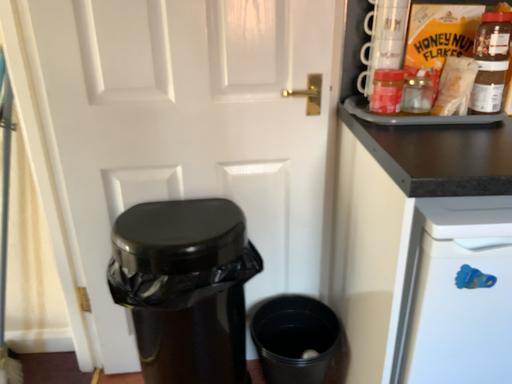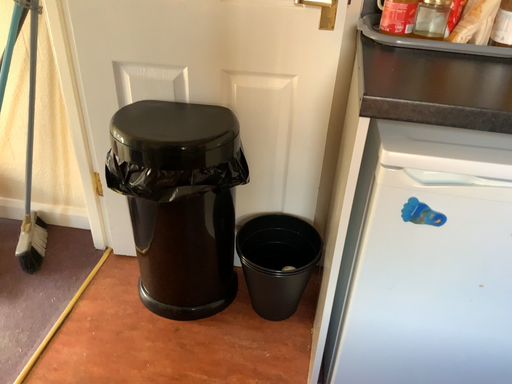
Question: How did the camera likely rotate when shooting the video?

Choices:
 (A) rotated upward
 (B) rotated downward

Answer: (B)